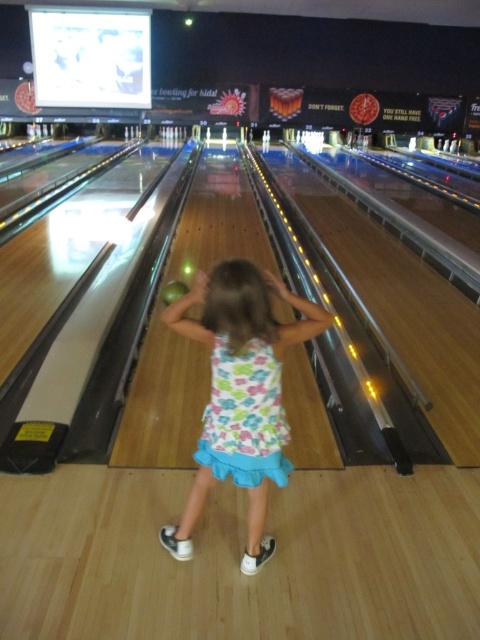
You are standing at the point marked as point (240,394) in the bowling alley scene. What object is located exactly at that point?

The white floral dress at center is located exactly at point (240,394).

You are standing at the end of the bowling lane and see the point marked at coordinates (244, 417). What object is located at that point?

The point at coordinates (244, 417) corresponds to the floral cotton dress at center.

You are standing at the point marked as point (260, 474) in the bowling alley. You want to roll a ball to hit the gutter on the right side of the lane. The gutter is 2.14 meters away from your position. Will the ball reach the gutter if you roll it with a force that can travel 2.2 meters?

The distance between your position and the gutter is 2.14 meters. Since the ball can travel 2.2 meters, which is slightly more than the required distance, the ball will reach the gutter.